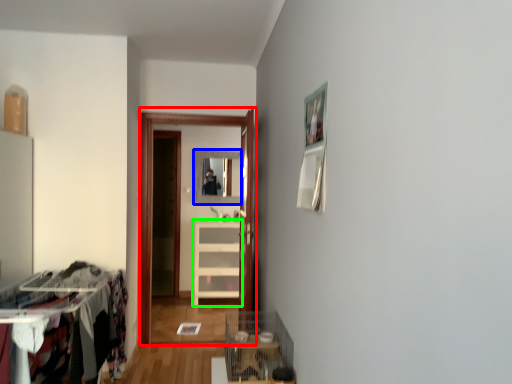
Question: Based on their relative distances, which object is nearer to glass door (highlighted by a red box)? Choose from mirror (highlighted by a blue box) and cabinetry (highlighted by a green box).

Choices:
 (A) mirror
 (B) cabinetry

Answer: (B)